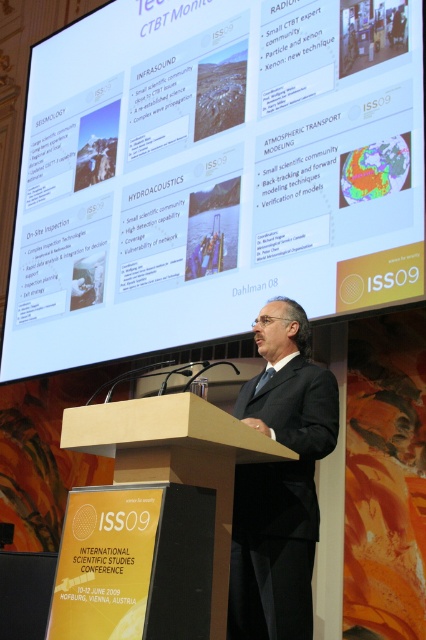
You are an attendee at the conference and want to take a photo of the speaker and the screen. Since you only have a wide angle lens, will you be able to frame both the white glossy projection screen at upper center and the black suit at center in the same shot?

The white glossy projection screen at upper center is positioned on the left side of the black suit at center, so they are aligned horizontally. With a wide angle lens, you should be able to capture both in the same frame as they are positioned side by side.

You are an event organizer who needs to set up a microphone stand for the speaker. The microphone stand requires at least 1.5 meters of space between the podium and the screen to avoid interference. Based on the image provided, will the current setup allow placing the microphone stand between the brown wood podium at center and the white glossy projection screen at upper center?

The distance between the white glossy projection screen at upper center and the brown wood podium at center is 2.22 meters, which is more than the required 1.5 meters. Therefore, the microphone stand can be placed between them without interference.

You are an attendee at the conference and want to approach the speaker. Since the black suit at center is blocking your path to the podium, can you go around the brown wood podium at center to reach the speaker?

The brown wood podium at center is behind the black suit at center, so the podium is not in front of the speaker. Therefore, you can approach the speaker by going around either side of the brown wood podium at center since the black suit at center is in front of the podium, not blocking the sides.